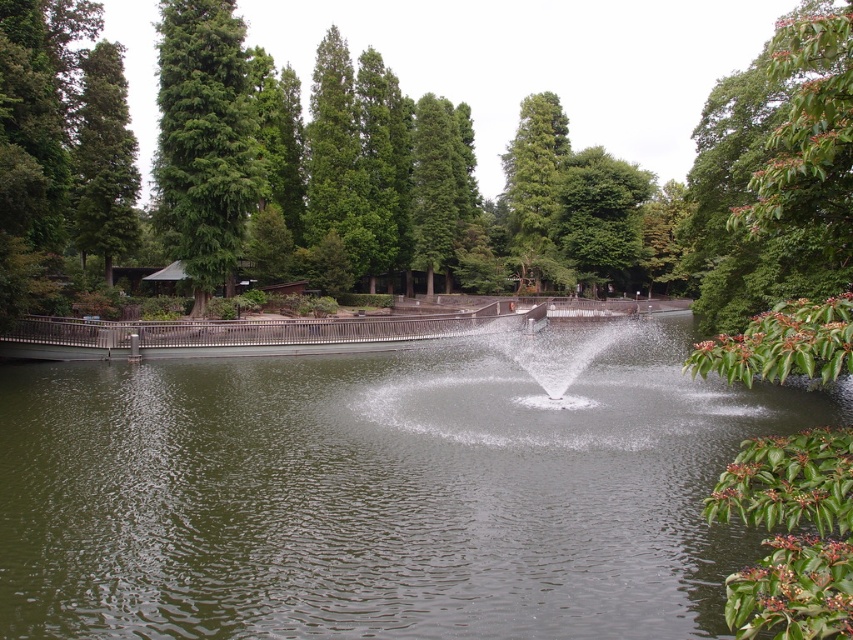
Can you confirm if clear water at center is positioned above green matte tree at upper center?

No, clear water at center is not above green matte tree at upper center.

Measure the distance between clear water at center and camera.

clear water at center is 8.90 meters away from camera.

Locate an element on the screen. Image resolution: width=853 pixels, height=640 pixels. clear water at center is located at coordinates (381, 490).

Can you confirm if green matte tree at upper left is bigger than green leafy tree at upper center?

Incorrect, green matte tree at upper left is not larger than green leafy tree at upper center.

Is point (224, 131) closer to camera compared to point (622, 170)?

Yes.

You are a GUI agent. You are given a task and a screenshot of the screen. Output one action in this format:
    pyautogui.click(x=<x>, y=<y>)
    Task: Click on the green matte tree at upper left
    
    Given the screenshot: What is the action you would take?
    pyautogui.click(x=204, y=140)

Which of these two, green matte tree at upper left or green matte tree at left, stands shorter?

With less height is green matte tree at left.

Is point (250, 129) in front of point (106, 81)?

Yes, point (250, 129) is in front of point (106, 81).

In order to click on green matte tree at upper left in this screenshot , I will do `click(204, 140)`.